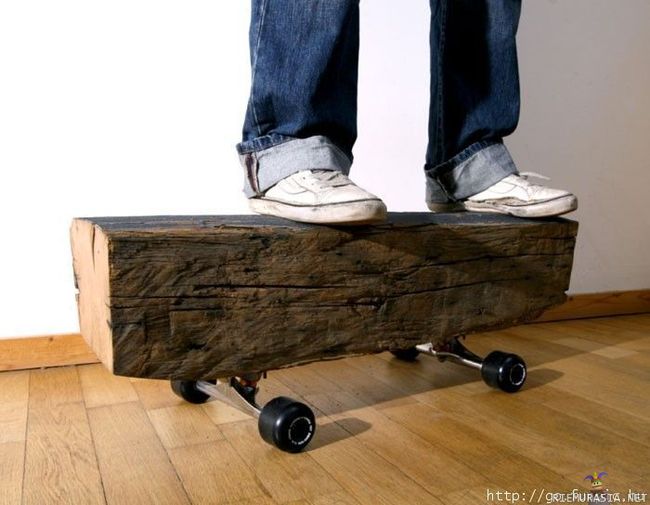
Where is `floor`? The height and width of the screenshot is (505, 650). floor is located at coordinates (342, 483).